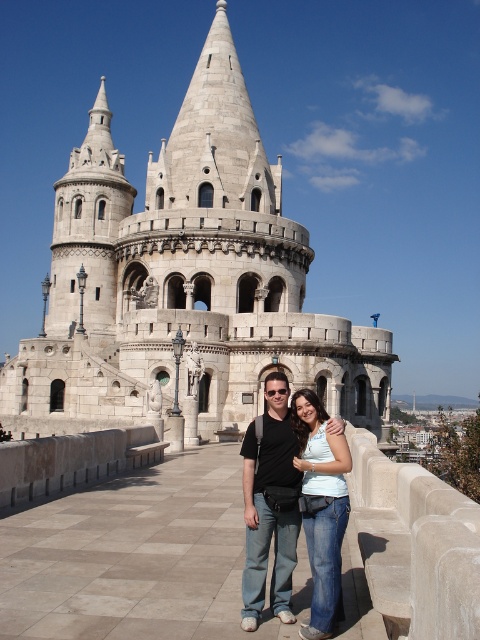
You are standing in front of the historic stone structure and want to take a photo. You notice two points marked in the scene. Which point is closer to you, point (164, 317) or point (267, 500)?

Point (164, 317) is closer to you because it is further to the viewer than point (267, 500).

You are a photographer standing at the edge of the paved walkway, aiming to capture the white stone fort at center and the denim jeans at center in your shot. Based on their positions, which object is located to the left of the other?

The white stone fort at center is positioned on the left side of denim jeans at center, so the white stone fort at center is to the left of the denim jeans at center.

You are a photographer setting up a shot of the white stone fort at center and the denim jeans at center. Which object should you focus on first if you want to capture both in a single frame without moving the camera?

The white stone fort at center is wider than the denim jeans at center, so you should focus on the white stone fort at center first to ensure it fits within the frame.